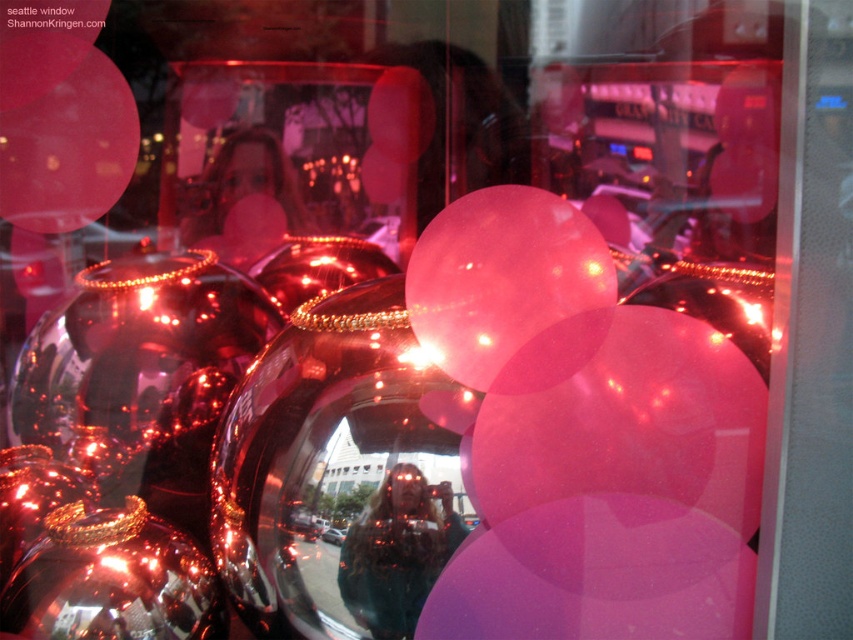
Who is more distant from viewer, (73, 92) or (410, 136)?

Positioned behind is point (410, 136).

Is pink matte balloon at upper left to the left of pink glossy balloon at center from the viewer's perspective?

Indeed, pink matte balloon at upper left is positioned on the left side of pink glossy balloon at center.

Is point (123, 125) positioned behind point (376, 138)?

No, (123, 125) is closer to viewer.

Locate an element on the screen. This screenshot has width=853, height=640. pink matte balloon at upper left is located at coordinates (68, 148).

Which is more to the right, pink translucent balloon at center or pink matte balloon at upper left?

pink translucent balloon at center is more to the right.

Is pink translucent balloon at center behind pink matte balloon at upper left?

No, it is not.

Is point (532, 312) positioned before point (9, 129)?

Yes.

Locate an element on the screen. The height and width of the screenshot is (640, 853). pink translucent balloon at center is located at coordinates (502, 276).

Is pink translucent balloon at center positioned at the back of pink glossy balloon at center?

No, it is not.

Between point (486, 376) and point (399, 93), which one is positioned in front?

Point (486, 376) is more forward.

The image size is (853, 640). What are the coordinates of `pink translucent balloon at center` in the screenshot? It's located at (502, 276).